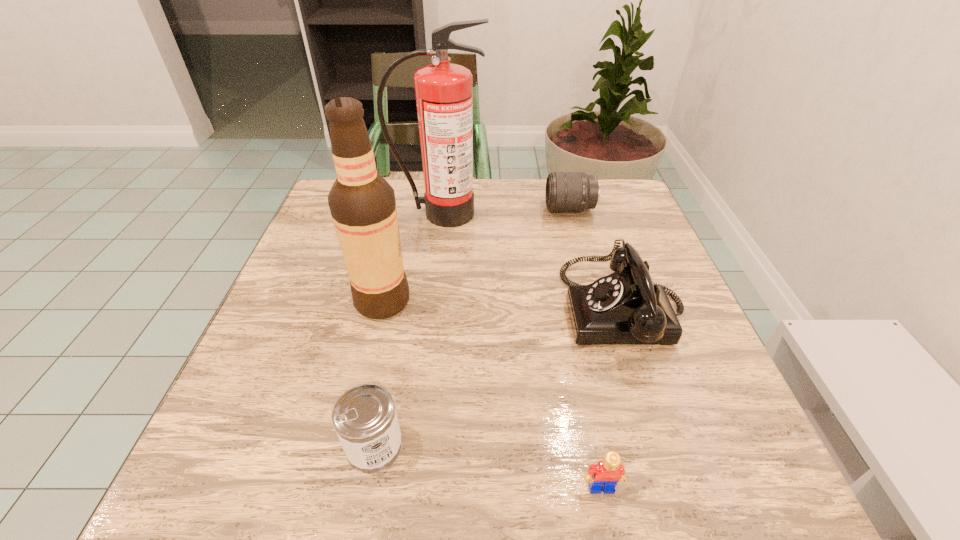
Image resolution: width=960 pixels, height=540 pixels. Find the location of `fire extinguisher`. fire extinguisher is located at coordinates (443, 91).

Find the location of a particular element. The width and height of the screenshot is (960, 540). alcohol is located at coordinates (362, 203).

Find the location of a particular element. The image size is (960, 540). the fourth shortest object is located at coordinates (626, 307).

This screenshot has height=540, width=960. In order to click on telephoto lens in this screenshot , I will do `click(565, 191)`.

Where is `the second nearest object`? The width and height of the screenshot is (960, 540). the second nearest object is located at coordinates (x=364, y=417).

You are a GUI agent. You are given a task and a screenshot of the screen. Output one action in this format:
    pyautogui.click(x=<x>, y=<y>)
    Task: Click on the nearest object
    The width and height of the screenshot is (960, 540).
    Given the screenshot: What is the action you would take?
    pyautogui.click(x=606, y=474)

Where is `vacant space located 0.260m on the front-facing side of the fire extinguisher`? vacant space located 0.260m on the front-facing side of the fire extinguisher is located at coordinates (429, 302).

In order to click on free spot located 0.330m on the label of the alcohol in this screenshot , I will do `click(571, 301)`.

You are a GUI agent. You are given a task and a screenshot of the screen. Output one action in this format:
    pyautogui.click(x=<x>, y=<y>)
    Task: Click on the free region located on the dial of the telephone
    
    Given the screenshot: What is the action you would take?
    pyautogui.click(x=396, y=310)

Identify the location of vacant space located on the dial of the telephone. point(426,310).